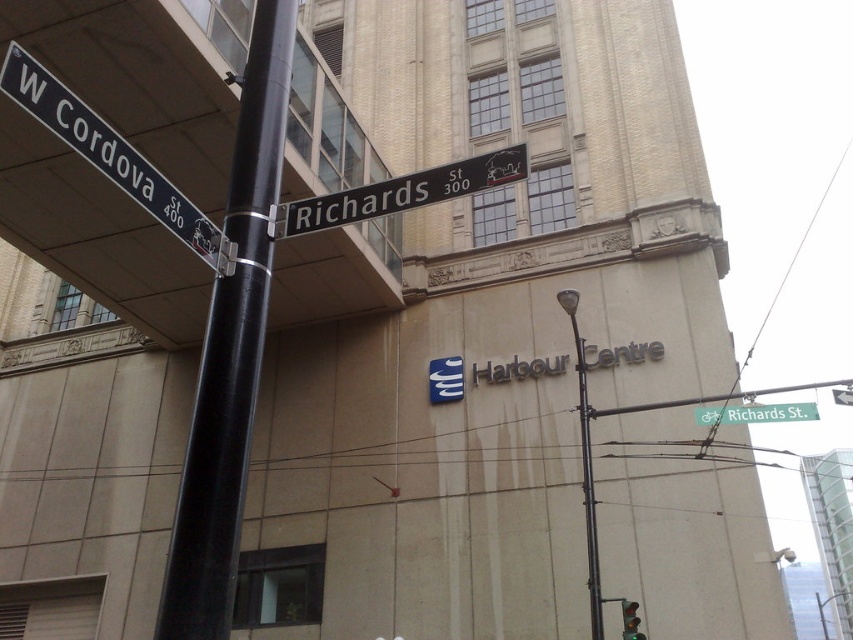
Consider the image. Can you confirm if green metallic street sign at upper center is positioned below metallic traffic light at lower right?

No.

Is green metallic street sign at upper center to the right of metallic traffic light at lower right from the viewer's perspective?

Correct, you'll find green metallic street sign at upper center to the right of metallic traffic light at lower right.

Find the location of a particular element. green metallic street sign at upper center is located at coordinates pos(756,413).

I want to click on green metallic street sign at upper center, so click(756, 413).

Between black metal pole at left and white plastic street sign at upper left, which one appears on the right side from the viewer's perspective?

From the viewer's perspective, black metal pole at left appears more on the right side.

Which of these two, black metal pole at left or white plastic street sign at upper left, stands taller?

Standing taller between the two is black metal pole at left.

Between point (263, 22) and point (213, 269), which one is positioned in front?

Positioned in front is point (213, 269).

You are a GUI agent. You are given a task and a screenshot of the screen. Output one action in this format:
    pyautogui.click(x=<x>, y=<y>)
    Task: Click on the black metal pole at left
    
    Given the screenshot: What is the action you would take?
    pyautogui.click(x=231, y=349)

Does point (283, 209) lie in front of point (624, 637)?

That is True.

Identify the location of black metal street sign at center. This screenshot has width=853, height=640. pyautogui.click(x=399, y=193).